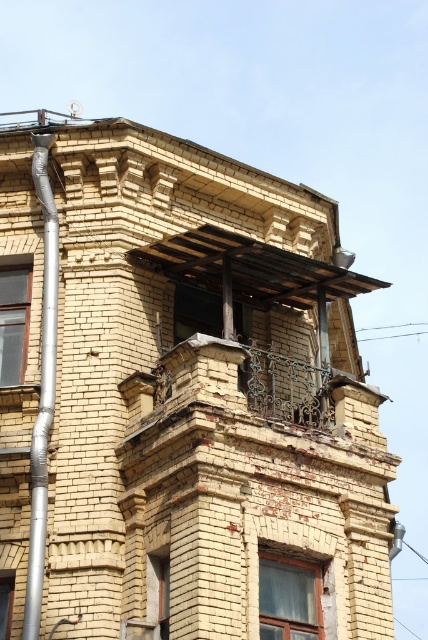
Between point (45, 442) and point (199, 332), which one is positioned in front?

Point (45, 442) is more forward.

Between point (30, 444) and point (183, 292), which one is positioned behind?

The point (183, 292) is more distant.

Between point (53, 211) and point (187, 292), which one is positioned in front?

Point (53, 211) is more forward.

Where is `silver metallic pipe at left`? The width and height of the screenshot is (428, 640). silver metallic pipe at left is located at coordinates (41, 388).

Between matte glass window at center and clear glass window at left, which one is positioned lower?

matte glass window at center is below.

Can you confirm if matte glass window at center is positioned to the right of clear glass window at left?

Yes, matte glass window at center is to the right of clear glass window at left.

The width and height of the screenshot is (428, 640). In order to click on matte glass window at center in this screenshot , I will do click(290, 596).

Looking at this image, is silver metallic pipe at left positioned before matte glass window at center?

Yes, silver metallic pipe at left is closer to the viewer.

Between silver metallic pipe at left and matte glass window at center, which one has more height?

With more height is silver metallic pipe at left.

You are a GUI agent. You are given a task and a screenshot of the screen. Output one action in this format:
    pyautogui.click(x=<x>, y=<y>)
    Task: Click on the silver metallic pipe at left
    Image resolution: width=428 pixels, height=640 pixels.
    Given the screenshot: What is the action you would take?
    pyautogui.click(x=41, y=388)

This screenshot has height=640, width=428. I want to click on silver metallic pipe at left, so click(x=41, y=388).